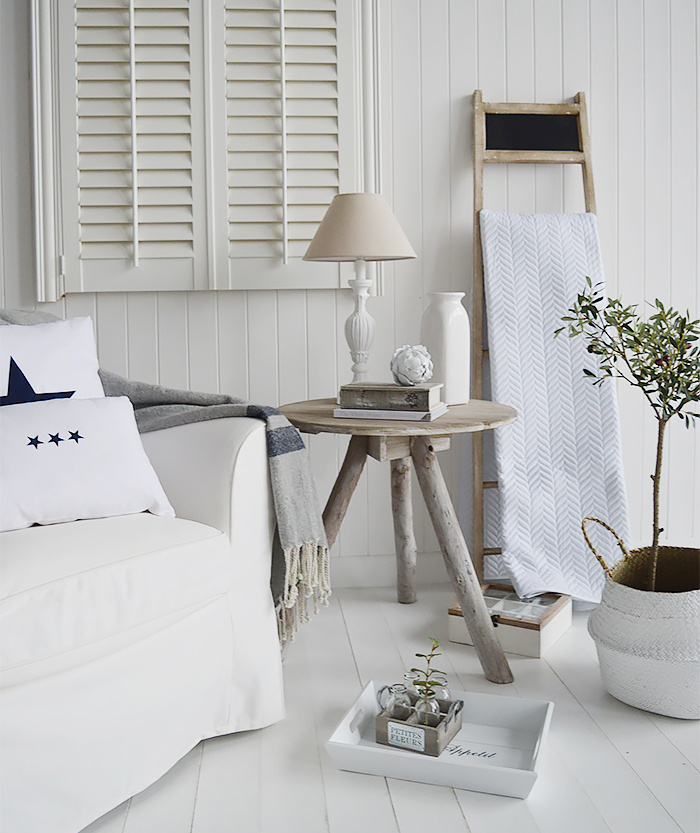
Find the location of a particular element. The height and width of the screenshot is (833, 700). shade is located at coordinates (350, 225).